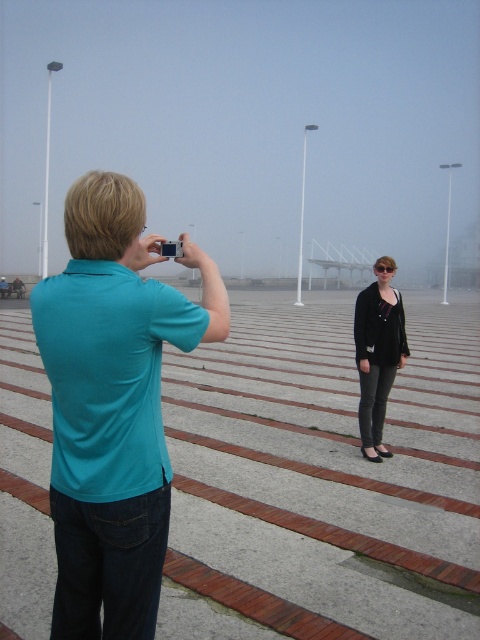
You are a photographer trying to decide where to position yourself to capture both the teal fabric shirt at left and the black matte cardigan at center in the same frame. Based on their heights, which person should you focus on to ensure both are fully visible?

Since the teal fabric shirt at left is shorter than the black matte cardigan at center, you should focus on the taller individual, the black matte cardigan at center, to ensure both are fully visible in the frame.

You are a photographer trying to adjust your position to ensure the teal fabric shirt at left is in the frame. Based on its coordinates, where should you position your camera?

The teal fabric shirt at left is located at point (112, 404), so you should position your camera to focus on that coordinate to ensure it stays in the frame.